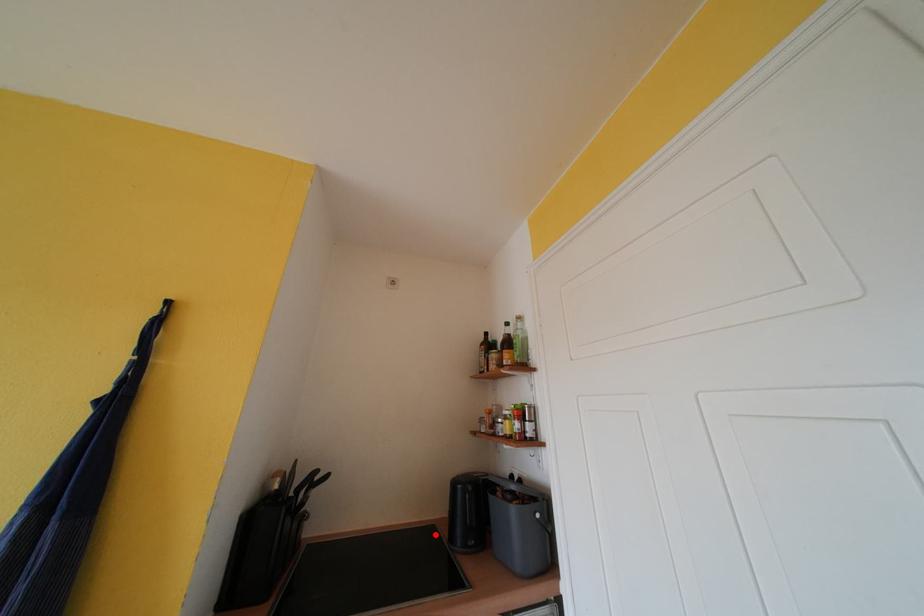
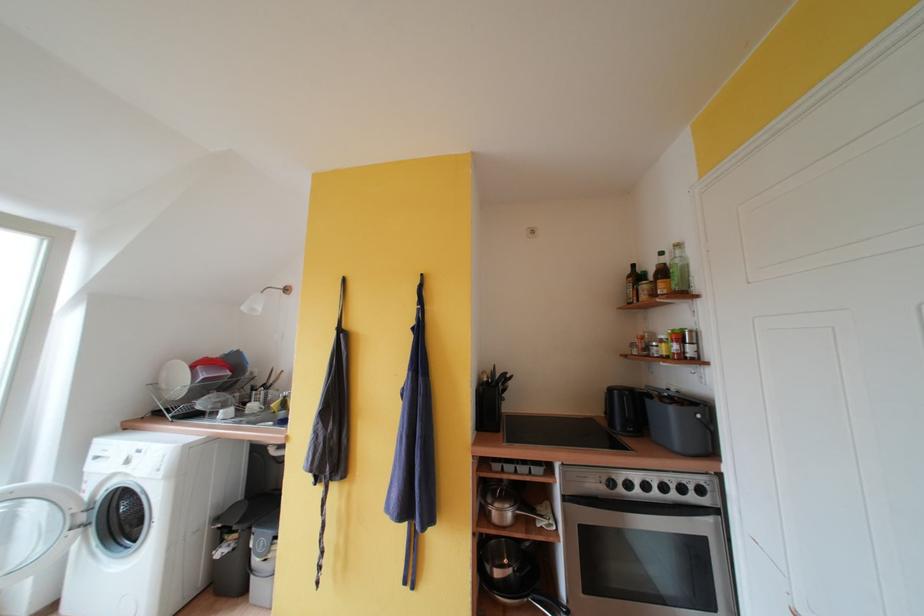
Find the pixel in the second image that matches the highlighted location in the first image.

(594, 424)